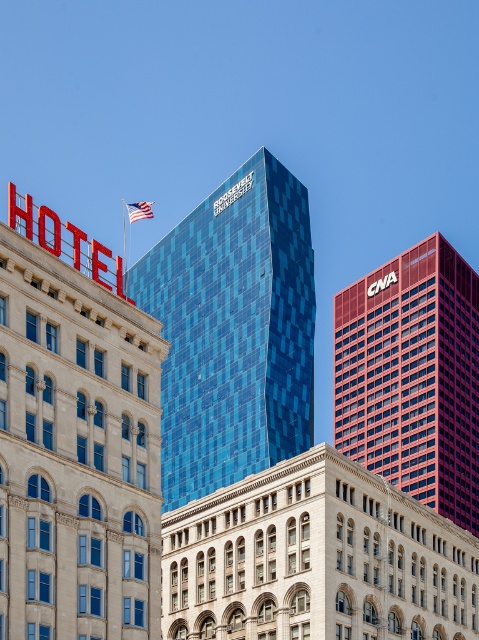
Question: Does matte red building at right lie behind american flag at upper center?

Choices:
 (A) yes
 (B) no

Answer: (B)

Question: Is blue glass skyscraper at center bigger than matte red building at right?

Choices:
 (A) no
 (B) yes

Answer: (A)

Question: Estimate the real-world distances between objects in this image. Which object is closer to the blue glass building at center?

Choices:
 (A) american flag at upper center
 (B) blue glass skyscraper at center

Answer: (B)

Question: Is blue glass building at center further to camera compared to american flag at upper center?

Choices:
 (A) no
 (B) yes

Answer: (A)

Question: Which point appears closest to the camera in this image?

Choices:
 (A) (134, 218)
 (B) (392, 316)

Answer: (B)

Question: Which of the following is the farthest from the observer?

Choices:
 (A) (262, 424)
 (B) (344, 420)
 (C) (140, 218)

Answer: (C)